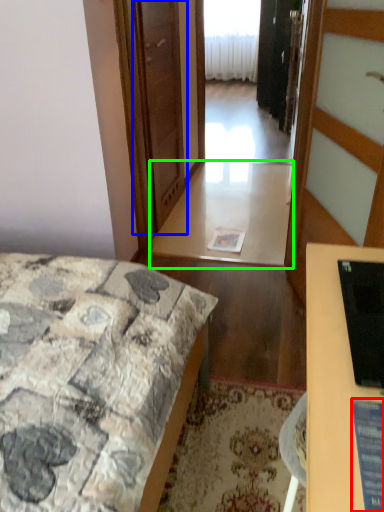
Question: Estimate the real-world distances between objects in this image. Which object is farther from computer screen (highlighted by a red box), screen door (highlighted by a blue box) or table (highlighted by a green box)?

Choices:
 (A) screen door
 (B) table

Answer: (B)